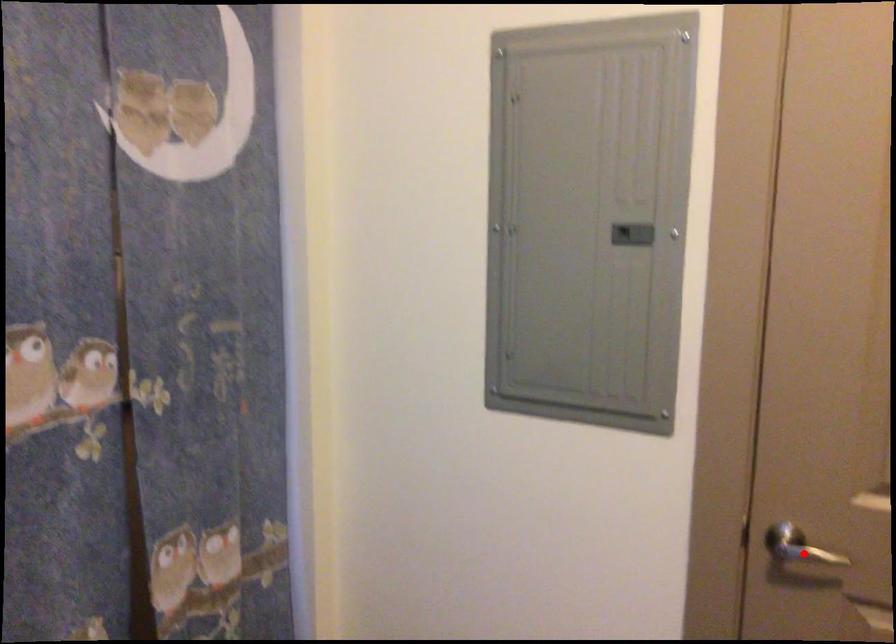
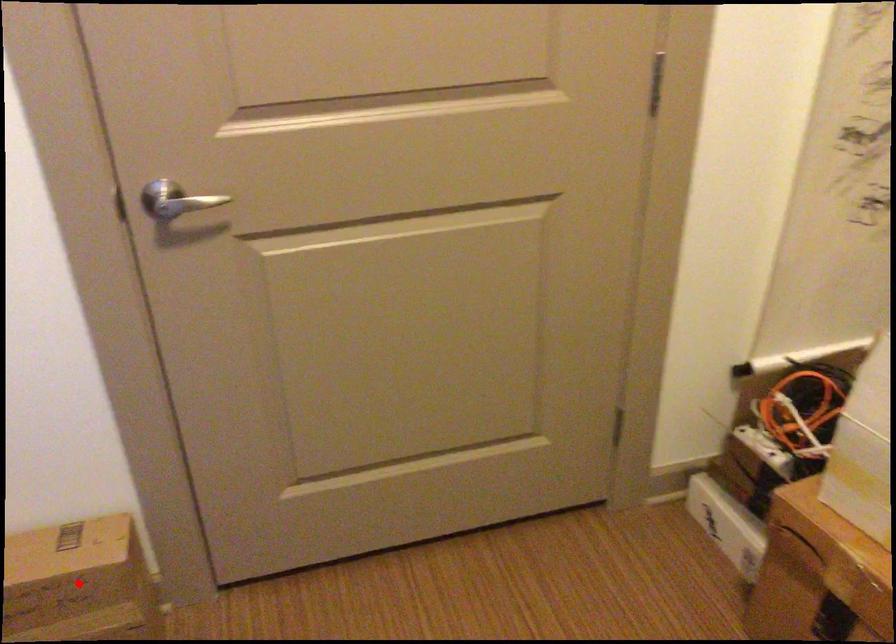
I am providing you with two images of the same scene from different viewpoints. A red point is marked on the first image and another point is marked on the second image. Do the highlighted points in image1 and image2 indicate the same real-world spot?

No